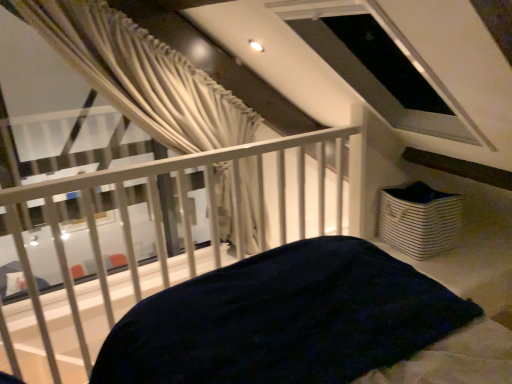
Question: Is white metal railing at upper center inside the boundaries of white striped fabric basket at lower right, or outside?

Choices:
 (A) inside
 (B) outside

Answer: (B)

Question: Would you say white metal railing at upper center is to the left or to the right of white striped fabric basket at lower right in the picture?

Choices:
 (A) right
 (B) left

Answer: (B)

Question: Does point click(x=10, y=188) appear closer or farther from the camera than point click(x=408, y=236)?

Choices:
 (A) closer
 (B) farther

Answer: (A)

Question: From the image's perspective, is white striped fabric basket at lower right located above or below white metal railing at upper center?

Choices:
 (A) above
 (B) below

Answer: (A)

Question: Looking at their shapes, would you say white striped fabric basket at lower right is wider or thinner than white metal railing at upper center?

Choices:
 (A) wide
 (B) thin

Answer: (B)

Question: Is point (379, 205) positioned closer to the camera than point (345, 175)?

Choices:
 (A) farther
 (B) closer

Answer: (B)

Question: Relative to white metal railing at upper center, is white striped fabric basket at lower right in front or behind?

Choices:
 (A) front
 (B) behind

Answer: (B)